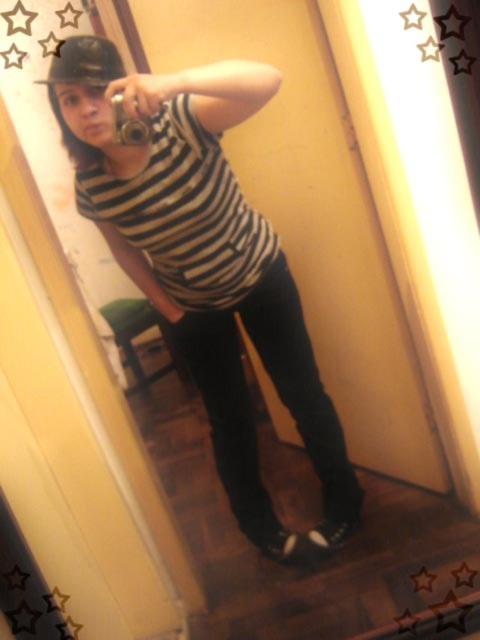
You are standing in a bathroom and want to adjust your hat without moving your shirt. Since you can see both the striped fabric shirt at center and the black matte baseball hat at upper left in the mirror, which object should you reach toward first?

You should reach toward the black matte baseball hat at upper left first because it is farther from you than the striped fabric shirt at center, so you need to extend your arm further to adjust it while keeping your shirt in place.

You are standing in a bathroom and see your reflection in the mirror. You notice a point marked at coordinates (210,269) in the image. According to the scene description, what object is located at that point?

The point at (210,269) corresponds to the striped fabric shirt at center.

You are trying to decide which item to place in a storage box that can only fit items narrower than the other. Based on the scene, which item should you choose between the striped fabric shirt at center and the black matte baseball hat at upper left?

The black matte baseball hat at upper left should be chosen because the striped fabric shirt at center is wider than the black matte baseball hat at upper left, making the hat narrower and thus fitting better in the storage box.